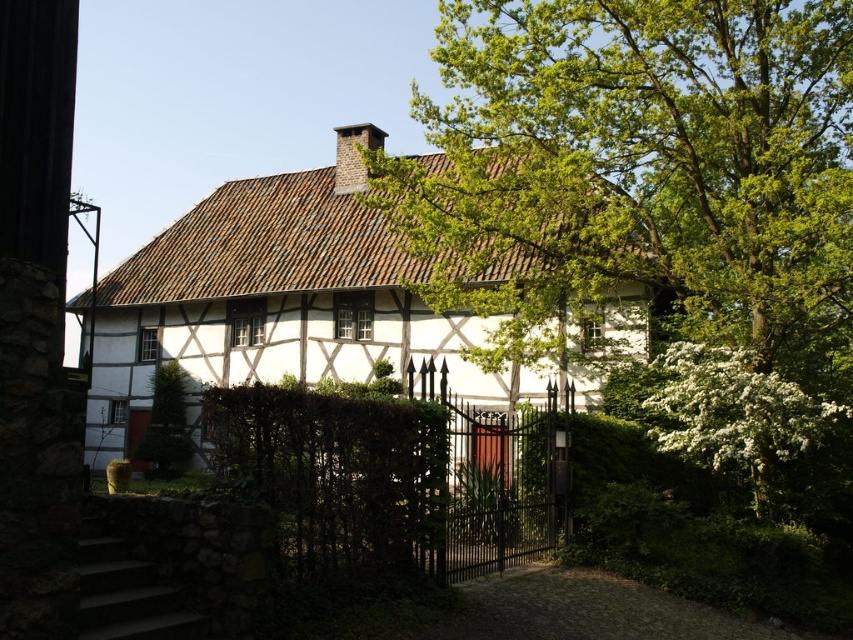
You are standing in front of the traditional half timbered house and want to take a photo. There are two points marked in the image, point 1 at coordinates point (x=805, y=161) and point 2 at coordinates point (x=126, y=420). Which point is closer to you when you are facing the house?

Point (x=805, y=161) is closer to the camera than point (x=126, y=420), so the point closer to you is point (x=805, y=161).